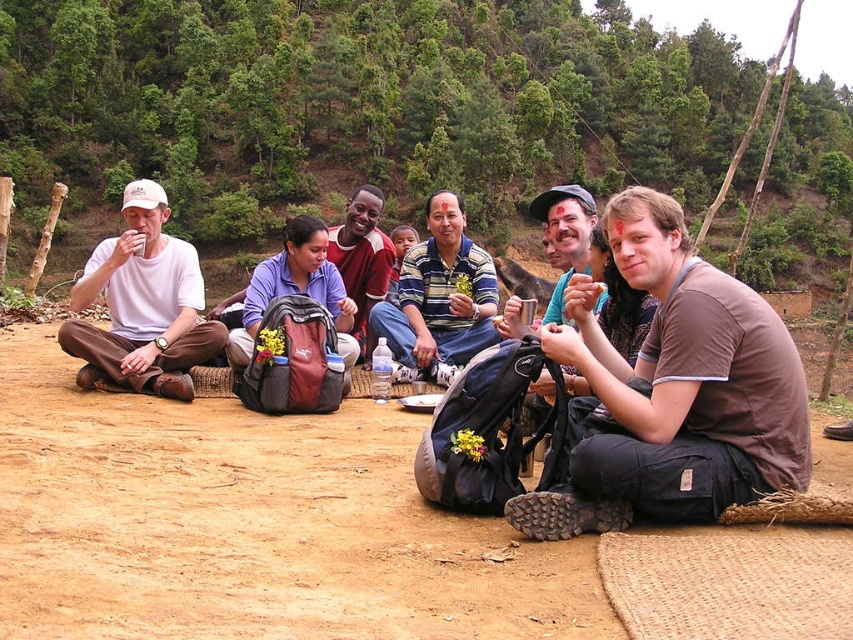
Does brown dirt field at lower center appear on the left side of brown cotton shirt at center?

Indeed, brown dirt field at lower center is positioned on the left side of brown cotton shirt at center.

Is brown dirt field at lower center below brown cotton shirt at center?

Yes, brown dirt field at lower center is below brown cotton shirt at center.

Does point (62, 518) come farther from viewer compared to point (695, 417)?

No, (62, 518) is closer to viewer.

You are a GUI agent. You are given a task and a screenshot of the screen. Output one action in this format:
    pyautogui.click(x=<x>, y=<y>)
    Task: Click on the brown dirt field at lower center
    
    Given the screenshot: What is the action you would take?
    pyautogui.click(x=248, y=525)

Which is below, matte white shirt at left or blue fabric shirt at center?

matte white shirt at left is below.

From the picture: Does matte white shirt at left have a larger size compared to blue fabric shirt at center?

Indeed, matte white shirt at left has a larger size compared to blue fabric shirt at center.

Who is more forward, (193, 262) or (247, 307)?

Positioned in front is point (247, 307).

Locate an element on the screen. matte white shirt at left is located at coordinates (142, 305).

Is point (701, 512) positioned before point (373, 198)?

Yes.

Is brown cotton shirt at center below blue fabric shirt at center?

Yes.

Which is in front, point (688, 376) or point (331, 234)?

Positioned in front is point (688, 376).

Image resolution: width=853 pixels, height=640 pixels. I want to click on brown cotton shirt at center, so click(x=671, y=392).